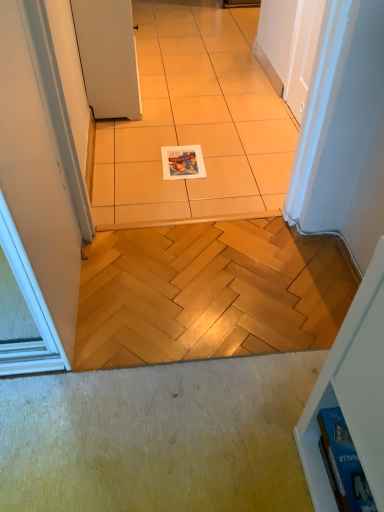
Locate an element on the screen. The height and width of the screenshot is (512, 384). white matte door at upper left is located at coordinates (108, 57).

Describe the element at coordinates (108, 57) in the screenshot. The width and height of the screenshot is (384, 512). I see `white matte door at upper left` at that location.

What do you see at coordinates (344, 463) in the screenshot? I see `blue glossy magazine at lower right, positioned as the first magazine in bottom-to-top order` at bounding box center [344, 463].

Locate an element on the screen. The height and width of the screenshot is (512, 384). beige ceramic tile at center is located at coordinates (195, 125).

What are the coordinates of `matte paper magazine at center, which appears as the 1th magazine when viewed from the left` in the screenshot? It's located at coord(182,162).

Where is `white matte door at upper left`? Image resolution: width=384 pixels, height=512 pixels. white matte door at upper left is located at coordinates (108, 57).

At what (x,y) coordinates should I click in order to perform the action: click on door located on the left of beige ceramic tile at center. Please return your answer as a coordinate pair (x, y). Looking at the image, I should click on (108, 57).

Which of these two, white matte door at upper left or beige ceramic tile at center, stands shorter?

beige ceramic tile at center is shorter.

Which of these two, white matte door at upper left or beige ceramic tile at center, is wider?

With larger width is beige ceramic tile at center.

From the image's perspective, is white matte door at upper left beneath beige ceramic tile at center?

No, from the image's perspective, white matte door at upper left is not below beige ceramic tile at center.

Between point (337, 466) and point (199, 155), which one is positioned in front?

The point (337, 466) is in front.

Who is bigger, blue glossy magazine at lower right, the second magazine positioned from the back, or matte paper magazine at center, marked as the first magazine in a top-to-bottom arrangement?

Bigger between the two is matte paper magazine at center, marked as the first magazine in a top-to-bottom arrangement.

Is blue glossy magazine at lower right, the second magazine positioned from the back, wider than matte paper magazine at center, which appears as the 1th magazine when viewed from the left?

In fact, blue glossy magazine at lower right, the second magazine positioned from the back, might be narrower than matte paper magazine at center, which appears as the 1th magazine when viewed from the left.

Are blue glossy magazine at lower right, the second magazine viewed from the top, and matte paper magazine at center, the second magazine in the bottom-to-top sequence, located far from each other?

blue glossy magazine at lower right, the second magazine viewed from the top, is positioned a significant distance from matte paper magazine at center, the second magazine in the bottom-to-top sequence.

Is matte paper magazine at center, placed as the first magazine when sorted from back to front, facing towards blue glossy magazine at lower right, the 1th magazine from the right?

No, matte paper magazine at center, placed as the first magazine when sorted from back to front, does not turn towards blue glossy magazine at lower right, the 1th magazine from the right.

Considering the relative sizes of matte paper magazine at center, which is the 2th magazine from front to back, and blue glossy magazine at lower right, the 1th magazine from the right, in the image provided, is matte paper magazine at center, which is the 2th magazine from front to back, thinner than blue glossy magazine at lower right, the 1th magazine from the right,?

In fact, matte paper magazine at center, which is the 2th magazine from front to back, might be wider than blue glossy magazine at lower right, the 1th magazine from the right.

Is point (196, 147) positioned before point (367, 501)?

No, it is not.

Is matte paper magazine at center, which is the 2th magazine from front to back, next to blue glossy magazine at lower right, which ranks as the second magazine in left-to-right order, and touching it?

No, matte paper magazine at center, which is the 2th magazine from front to back, is not next to blue glossy magazine at lower right, which ranks as the second magazine in left-to-right order.

Between point (323, 425) and point (282, 172), which one is positioned behind?

Positioned behind is point (282, 172).

Is blue glossy magazine at lower right, which ranks as the second magazine in left-to-right order, at the left side of beige ceramic tile at center?

In fact, blue glossy magazine at lower right, which ranks as the second magazine in left-to-right order, is to the right of beige ceramic tile at center.

Considering the sizes of blue glossy magazine at lower right, the second magazine viewed from the top, and beige ceramic tile at center in the image, is blue glossy magazine at lower right, the second magazine viewed from the top, bigger or smaller than beige ceramic tile at center?

blue glossy magazine at lower right, the second magazine viewed from the top, is smaller than beige ceramic tile at center.

From the image's perspective, which is below, blue glossy magazine at lower right, positioned as the first magazine in bottom-to-top order, or beige ceramic tile at center?

blue glossy magazine at lower right, positioned as the first magazine in bottom-to-top order, from the image's perspective.

Looking at the image, does beige ceramic tile at center seem bigger or smaller compared to matte paper magazine at center, the second magazine in the bottom-to-top sequence?

beige ceramic tile at center is bigger than matte paper magazine at center, the second magazine in the bottom-to-top sequence.

Considering the sizes of objects beige ceramic tile at center and matte paper magazine at center, which appears as the 1th magazine when viewed from the left, in the image provided, who is thinner, beige ceramic tile at center or matte paper magazine at center, which appears as the 1th magazine when viewed from the left,?

matte paper magazine at center, which appears as the 1th magazine when viewed from the left, is thinner.

Is beige ceramic tile at center to the left or to the right of matte paper magazine at center, which appears as the 1th magazine when viewed from the left, in the image?

From the image, it's evident that beige ceramic tile at center is to the left of matte paper magazine at center, which appears as the 1th magazine when viewed from the left.

Considering the relative sizes of beige ceramic tile at center and matte paper magazine at center, placed as the first magazine when sorted from back to front, in the image provided, is beige ceramic tile at center shorter than matte paper magazine at center, placed as the first magazine when sorted from back to front,?

Incorrect, the height of beige ceramic tile at center does not fall short of that of matte paper magazine at center, placed as the first magazine when sorted from back to front.

From the image's perspective, which is below, matte paper magazine at center, placed as the first magazine when sorted from back to front, or white matte door at upper left?

matte paper magazine at center, placed as the first magazine when sorted from back to front.

Visually, is matte paper magazine at center, the second magazine from the right, positioned to the left or to the right of white matte door at upper left?

From the image, it's evident that matte paper magazine at center, the second magazine from the right, is to the right of white matte door at upper left.

Would you say matte paper magazine at center, the second magazine from the right, is inside or outside white matte door at upper left?

matte paper magazine at center, the second magazine from the right, is outside white matte door at upper left.

Is point (173, 167) positioned behind point (104, 68)?

No, (173, 167) is in front of (104, 68).

Is beige ceramic tile at center a part of matte paper magazine at center, which appears as the 1th magazine when viewed from the left?

No.

Is matte paper magazine at center, the second magazine in the bottom-to-top sequence, not near beige ceramic tile at center?

matte paper magazine at center, the second magazine in the bottom-to-top sequence, is near beige ceramic tile at center, not far away.

Considering the sizes of objects matte paper magazine at center, the second magazine from the right, and beige ceramic tile at center in the image provided, who is taller, matte paper magazine at center, the second magazine from the right, or beige ceramic tile at center?

With more height is beige ceramic tile at center.

This screenshot has width=384, height=512. Find the location of `ceramic tile located in front of the matte paper magazine at center, which is the 2th magazine from front to back`. ceramic tile located in front of the matte paper magazine at center, which is the 2th magazine from front to back is located at coordinates (195, 125).

Image resolution: width=384 pixels, height=512 pixels. What are the coordinates of `door lying behind the beige ceramic tile at center` in the screenshot? It's located at (108, 57).

The width and height of the screenshot is (384, 512). Find the location of `magazine above the blue glossy magazine at lower right, positioned as the first magazine in bottom-to-top order (from the image's perspective)`. magazine above the blue glossy magazine at lower right, positioned as the first magazine in bottom-to-top order (from the image's perspective) is located at coordinates (182, 162).

Based on the photo, considering their positions, is matte paper magazine at center, the second magazine in the bottom-to-top sequence, positioned closer to white matte door at upper left than beige ceramic tile at center?

Among the two, beige ceramic tile at center is located nearer to white matte door at upper left.

Considering their positions, is matte paper magazine at center, the second magazine from the right, positioned further to white matte door at upper left than blue glossy magazine at lower right, which ranks as the second magazine in left-to-right order?

Based on the image, blue glossy magazine at lower right, which ranks as the second magazine in left-to-right order, appears to be further to white matte door at upper left.

Looking at the image, which one is located further to white matte door at upper left, beige ceramic tile at center or blue glossy magazine at lower right, the second magazine positioned from the back?

blue glossy magazine at lower right, the second magazine positioned from the back, is positioned further to the anchor white matte door at upper left.

Considering their positions, is matte paper magazine at center, the second magazine from the right, positioned further to blue glossy magazine at lower right, the 1th magazine from the right, than white matte door at upper left?

Based on the image, white matte door at upper left appears to be further to blue glossy magazine at lower right, the 1th magazine from the right.

Considering their positions, is white matte door at upper left positioned closer to matte paper magazine at center, the second magazine from the right, than blue glossy magazine at lower right, the second magazine viewed from the top?

white matte door at upper left lies closer to matte paper magazine at center, the second magazine from the right, than the other object.

When comparing their distances from blue glossy magazine at lower right, which is the first magazine in front-to-back order, does white matte door at upper left or matte paper magazine at center, placed as the first magazine when sorted from back to front, seem further?

Based on the image, white matte door at upper left appears to be further to blue glossy magazine at lower right, which is the first magazine in front-to-back order.

Looking at the image, which one is located further to beige ceramic tile at center, white matte door at upper left or blue glossy magazine at lower right, which is the first magazine in front-to-back order?

The object further to beige ceramic tile at center is blue glossy magazine at lower right, which is the first magazine in front-to-back order.

Which object lies nearer to the anchor point blue glossy magazine at lower right, which is the first magazine in front-to-back order, matte paper magazine at center, which is the 2th magazine from front to back, or beige ceramic tile at center?

matte paper magazine at center, which is the 2th magazine from front to back, lies closer to blue glossy magazine at lower right, which is the first magazine in front-to-back order, than the other object.

You are a GUI agent. You are given a task and a screenshot of the screen. Output one action in this format:
    pyautogui.click(x=<x>, y=<y>)
    Task: Click on the ceramic tile that lies between white matte door at upper left and blue glossy magazine at lower right, the second magazine positioned from the back, from top to bottom
    The width and height of the screenshot is (384, 512).
    Given the screenshot: What is the action you would take?
    pyautogui.click(x=195, y=125)

This screenshot has height=512, width=384. Identify the location of ceramic tile between white matte door at upper left and matte paper magazine at center, which is the 2th magazine from front to back, vertically. (195, 125).

Where is `magazine between white matte door at upper left and blue glossy magazine at lower right, the 1th magazine from the right, in the up-down direction`? This screenshot has height=512, width=384. magazine between white matte door at upper left and blue glossy magazine at lower right, the 1th magazine from the right, in the up-down direction is located at coordinates (182, 162).

The width and height of the screenshot is (384, 512). I want to click on magazine between beige ceramic tile at center and blue glossy magazine at lower right, which ranks as the second magazine in left-to-right order, from top to bottom, so click(x=182, y=162).